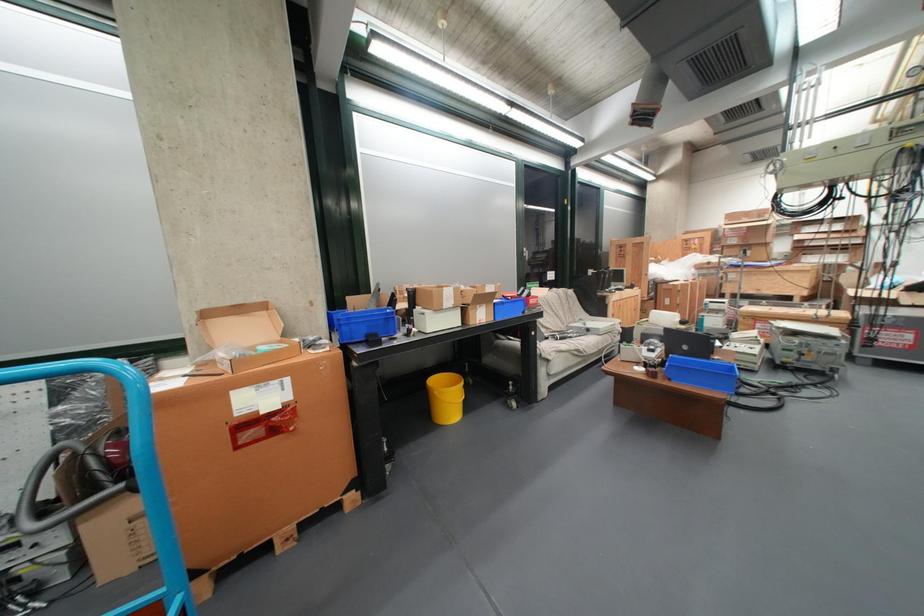
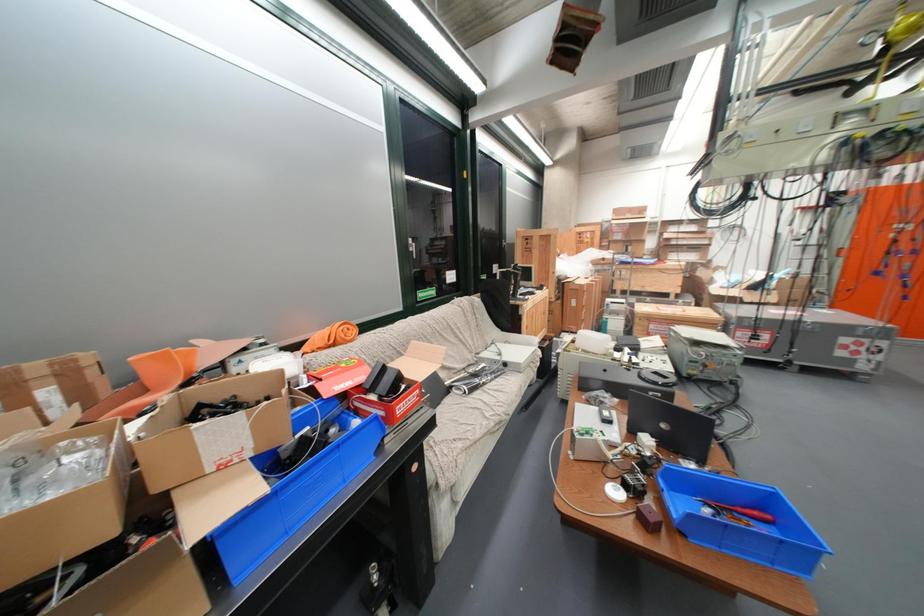
In a continuous first-person perspective shot, in which direction is the camera moving?

The cameraman walked toward right, forward.